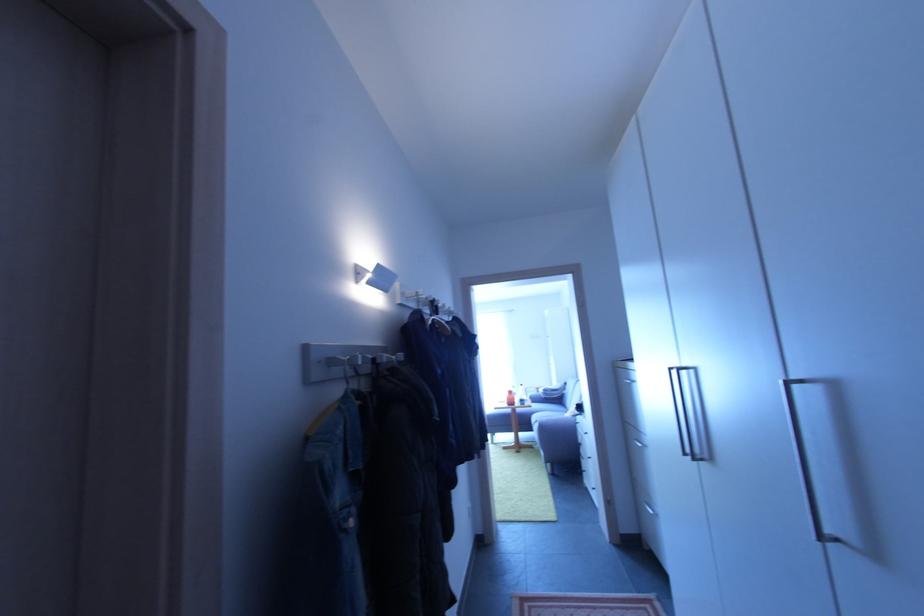
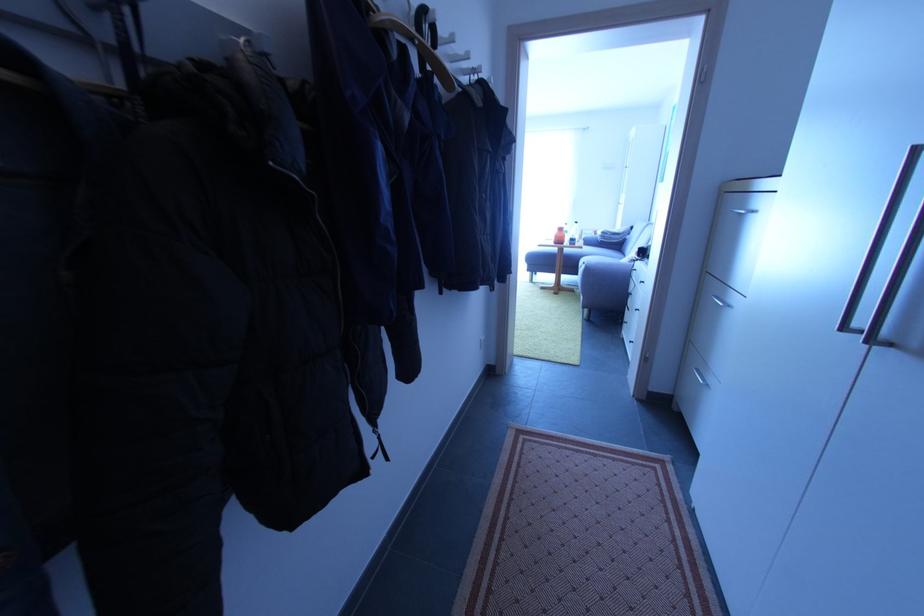
Where in the second image is the point corresponding to point 530,397 from the first image?

(585, 238)